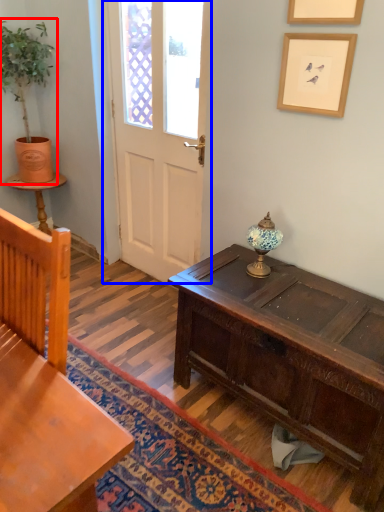
Question: Which object is further to the camera taking this photo, houseplant (highlighted by a red box) or door (highlighted by a blue box)?

Choices:
 (A) houseplant
 (B) door

Answer: (A)